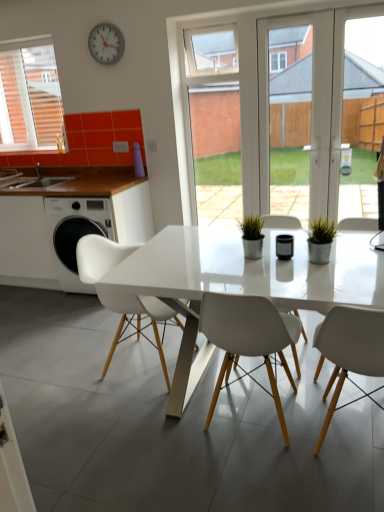
This screenshot has height=512, width=384. I want to click on free spot in front of black glossy pen holder at center, so click(x=287, y=270).